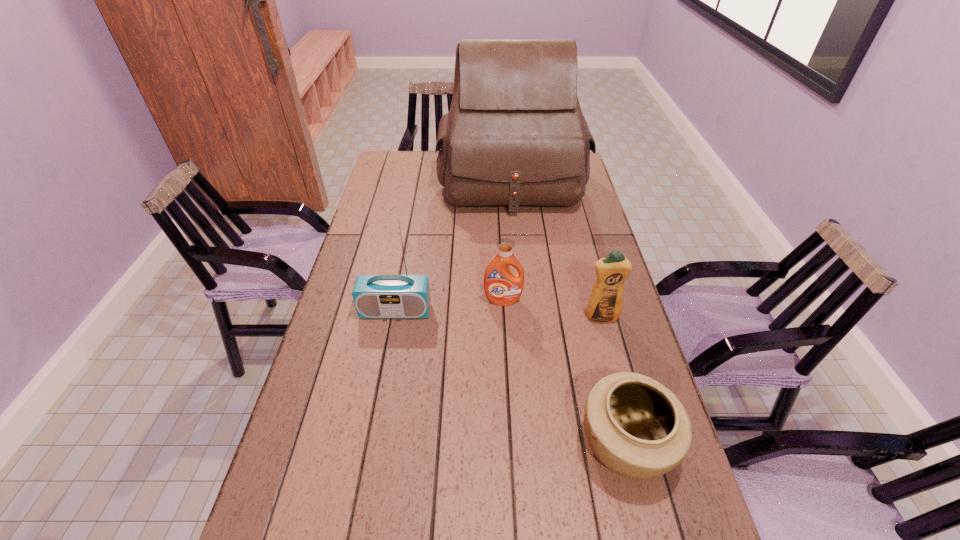
Where is `free space located on the front-facing side of the left detergent`? This screenshot has height=540, width=960. free space located on the front-facing side of the left detergent is located at coordinates (507, 383).

Find the location of a particular element. vacant region located 0.140m on the back of the shortest object is located at coordinates (603, 354).

The width and height of the screenshot is (960, 540). In order to click on object that is at the far edge in this screenshot , I will do click(x=515, y=135).

This screenshot has width=960, height=540. What are the coordinates of `object at the left edge` in the screenshot? It's located at (375, 296).

This screenshot has width=960, height=540. I want to click on satchel located in the right edge section of the desktop, so click(515, 135).

At what (x,y) coordinates should I click in order to perform the action: click on detergent located at the right edge. Please return your answer as a coordinate pair (x, y). This screenshot has height=540, width=960. Looking at the image, I should click on (605, 304).

At what (x,y) coordinates should I click in order to perform the action: click on pottery that is at the right edge. Please return your answer as a coordinate pair (x, y). Image resolution: width=960 pixels, height=540 pixels. Looking at the image, I should click on (636, 427).

You are a GUI agent. You are given a task and a screenshot of the screen. Output one action in this format:
    pyautogui.click(x=<x>, y=<y>)
    Task: Click on the object present at the far right corner
    This screenshot has width=960, height=540.
    Given the screenshot: What is the action you would take?
    pyautogui.click(x=515, y=135)

Image resolution: width=960 pixels, height=540 pixels. Identify the location of vacant area at the left edge of the desktop. (354, 253).

In the image, there is a desktop. Find the location of `free space at the right edge`. free space at the right edge is located at coordinates (565, 274).